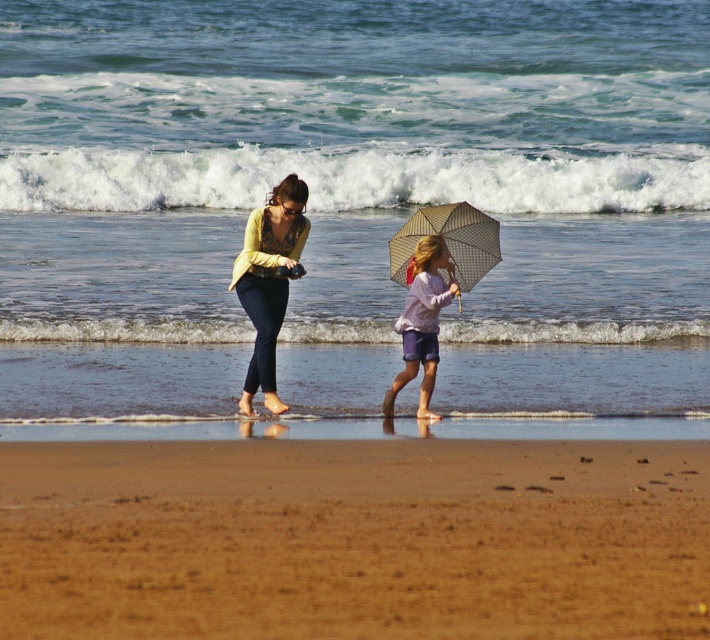
Question: Is brown sandy beach at lower center below checkered fabric umbrella at center?

Choices:
 (A) yes
 (B) no

Answer: (A)

Question: Which of these objects is positioned farthest from the brown sandy beach at lower center?

Choices:
 (A) light purple fabric umbrella at center
 (B) matte yellow sweater at center

Answer: (B)

Question: Which of the following is the closest to the observer?

Choices:
 (A) matte yellow sweater at center
 (B) light purple fabric umbrella at center

Answer: (A)

Question: In this image, where is matte yellow sweater at center located relative to light purple fabric umbrella at center?

Choices:
 (A) above
 (B) below

Answer: (A)

Question: Is matte yellow sweater at center thinner than light purple fabric umbrella at center?

Choices:
 (A) no
 (B) yes

Answer: (A)

Question: Which point is closer to the camera taking this photo?

Choices:
 (A) (425, 404)
 (B) (449, 212)

Answer: (A)